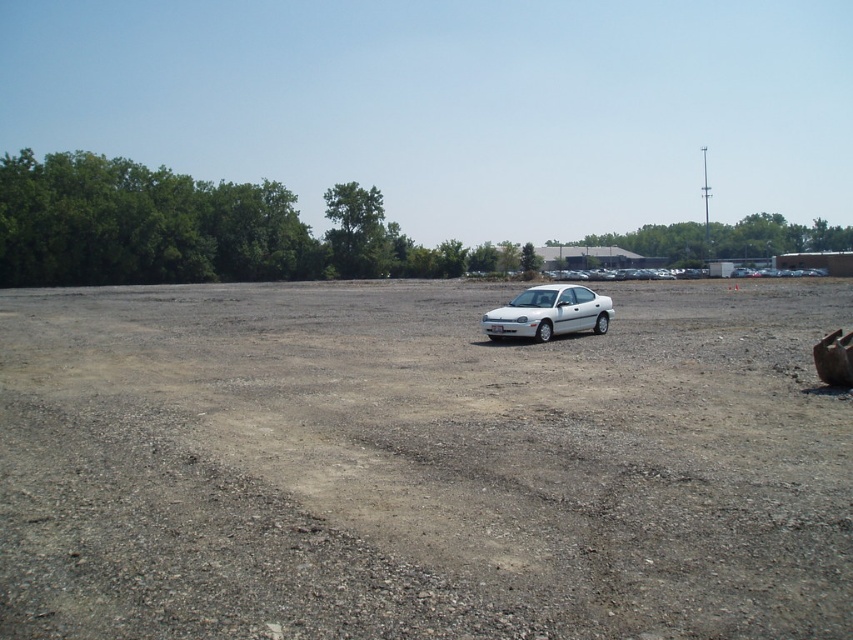
You are a delivery person who needs to drive a 5.5 meter long truck through the gray gravelly dirt field at center and the white matte car at center. Can the truck pass between them?

The gray gravelly dirt field at center and white matte car at center are 7.68 meters apart from each other, so the 5.5 meter long truck can pass between them since the distance is greater than the truck length.